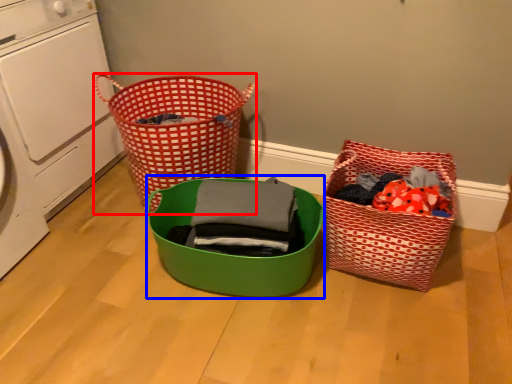
Question: Which object is further to the camera taking this photo, waste container (highlighted by a red box) or basket (highlighted by a blue box)?

Choices:
 (A) waste container
 (B) basket

Answer: (A)